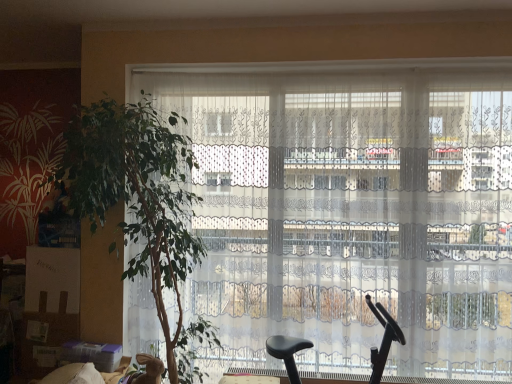
Question: Considering the relative positions of white lace curtains at center and green leafy plant at left in the image provided, is white lace curtains at center to the right of green leafy plant at left from the viewer's perspective?

Choices:
 (A) yes
 (B) no

Answer: (A)

Question: From a real-world perspective, is white lace curtains at center on top of green leafy plant at left?

Choices:
 (A) no
 (B) yes

Answer: (B)

Question: From the image's perspective, would you say white lace curtains at center is shown under green leafy plant at left?

Choices:
 (A) no
 (B) yes

Answer: (A)

Question: Does white lace curtains at center touch green leafy plant at left?

Choices:
 (A) no
 (B) yes

Answer: (A)

Question: Is white lace curtains at center positioned with its back to green leafy plant at left?

Choices:
 (A) yes
 (B) no

Answer: (A)

Question: Is white lace curtains at center taller or shorter than black plastic baby carriage at center?

Choices:
 (A) tall
 (B) short

Answer: (A)

Question: From a real-world perspective, is white lace curtains at center above or below black plastic baby carriage at center?

Choices:
 (A) below
 (B) above

Answer: (B)

Question: Would you say white lace curtains at center is to the left or to the right of black plastic baby carriage at center in the picture?

Choices:
 (A) left
 (B) right

Answer: (A)

Question: Is white lace curtains at center bigger or smaller than black plastic baby carriage at center?

Choices:
 (A) big
 (B) small

Answer: (A)

Question: From the image's perspective, is green leafy plant at left located above or below white lace curtains at center?

Choices:
 (A) below
 (B) above

Answer: (A)

Question: Is green leafy plant at left bigger or smaller than white lace curtains at center?

Choices:
 (A) big
 (B) small

Answer: (A)

Question: Looking at their shapes, would you say green leafy plant at left is wider or thinner than white lace curtains at center?

Choices:
 (A) wide
 (B) thin

Answer: (A)

Question: Is green leafy plant at left inside or outside of white lace curtains at center?

Choices:
 (A) outside
 (B) inside

Answer: (A)

Question: Looking at the image, does black plastic baby carriage at center seem bigger or smaller compared to white lace curtains at center?

Choices:
 (A) small
 (B) big

Answer: (A)

Question: From the image's perspective, relative to white lace curtains at center, is black plastic baby carriage at center above or below?

Choices:
 (A) above
 (B) below

Answer: (B)